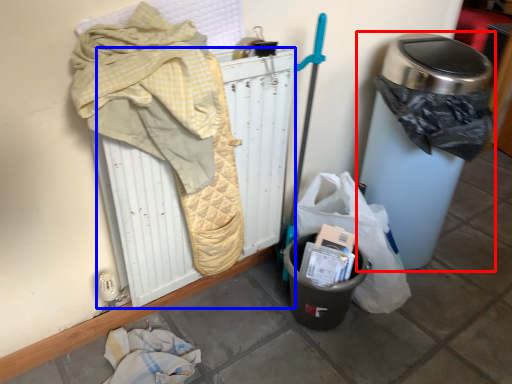
Question: Which point is further to the camera, waste container (highlighted by a red box) or radiator (highlighted by a blue box)?

Choices:
 (A) waste container
 (B) radiator

Answer: (A)